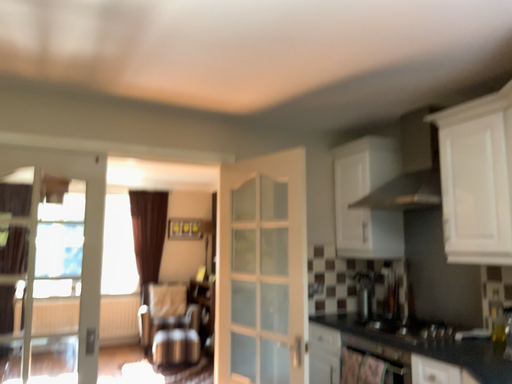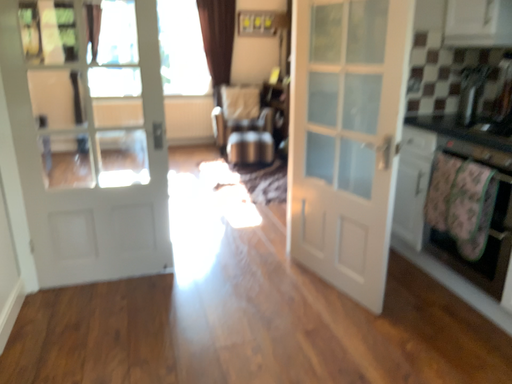
Question: How did the camera likely rotate when shooting the video?

Choices:
 (A) rotated left
 (B) rotated right

Answer: (A)